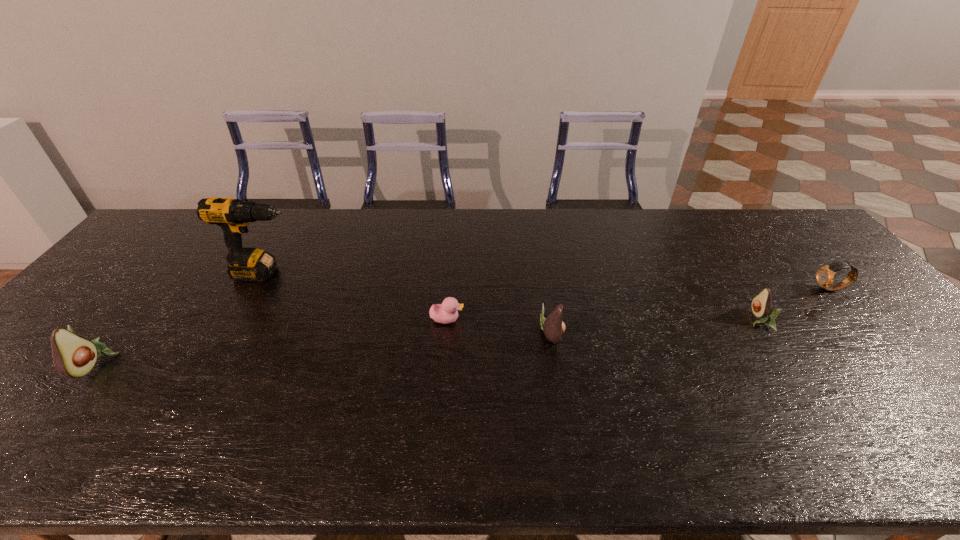
The height and width of the screenshot is (540, 960). I want to click on free point between the rightmost avocado and the second tallest avocado, so click(x=656, y=327).

Where is `vacant space in between the fourth object from right to left and the fifth object from left to right`? The width and height of the screenshot is (960, 540). vacant space in between the fourth object from right to left and the fifth object from left to right is located at coordinates (603, 320).

Where is `free space that is in between the shortest avocado and the second tallest object`? free space that is in between the shortest avocado and the second tallest object is located at coordinates (427, 342).

Image resolution: width=960 pixels, height=540 pixels. Find the location of `blank region between the second object from left to right and the duckling`. blank region between the second object from left to right and the duckling is located at coordinates (356, 296).

You are a GUI agent. You are given a task and a screenshot of the screen. Output one action in this format:
    pyautogui.click(x=<x>, y=<y>)
    Task: Click on the unoccupied area between the tallest object and the shortest object
    
    Given the screenshot: What is the action you would take?
    pyautogui.click(x=356, y=296)

Identify the location of empty location between the rightmost object and the leftmost object. The image size is (960, 540). (463, 326).

Where is `vacant region between the duckling and the leftmost avocado`? vacant region between the duckling and the leftmost avocado is located at coordinates pos(272,341).

Image resolution: width=960 pixels, height=540 pixels. I want to click on vacant space that's between the third object from right to left and the fifth object from left to right, so click(656, 327).

The height and width of the screenshot is (540, 960). Identify the location of vacant space in between the watch and the shortest avocado. (795, 305).

Identify which object is located as the third nearest to the second avocado from right to left. Please provide its 2D coordinates. Your answer should be formatted as a tuple, i.e. [(x, y)], where the tuple contains the x and y coordinates of a point satisfying the conditions above.

[(233, 215)]